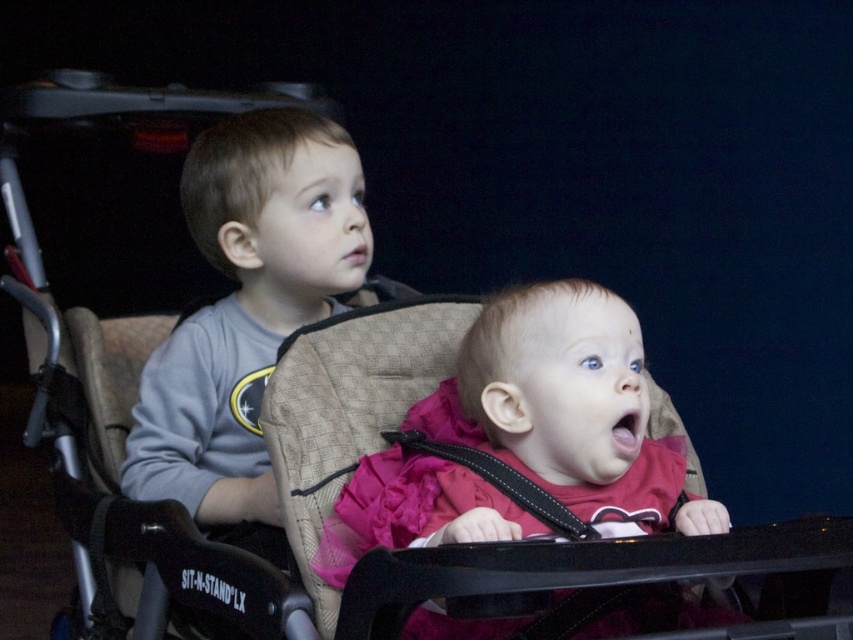
Question: Does pink satin dress at center appear on the left side of gray cotton shirt at left?

Choices:
 (A) no
 (B) yes

Answer: (A)

Question: Which point is farther to the camera?

Choices:
 (A) (521, 497)
 (B) (346, 236)

Answer: (B)

Question: Estimate the real-world distances between objects in this image. Which object is closer to the pink satin dress at center?

Choices:
 (A) gray cotton shirt at left
 (B) black leather strap at center

Answer: (B)

Question: Is pink satin dress at center bigger than black leather strap at center?

Choices:
 (A) yes
 (B) no

Answer: (A)

Question: Is gray cotton shirt at left wider than black leather strap at center?

Choices:
 (A) yes
 (B) no

Answer: (A)

Question: Which of these objects is positioned closest to the black leather strap at center?

Choices:
 (A) pink satin dress at center
 (B) gray cotton shirt at left

Answer: (A)